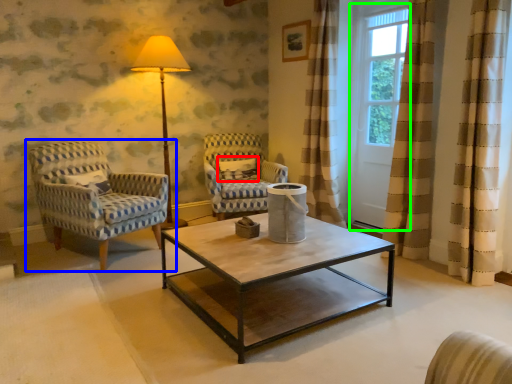
Question: Which object is the closest to the pillow (highlighted by a red box)? Choose among these: chair (highlighted by a blue box) or screen door (highlighted by a green box).

Choices:
 (A) chair
 (B) screen door

Answer: (A)